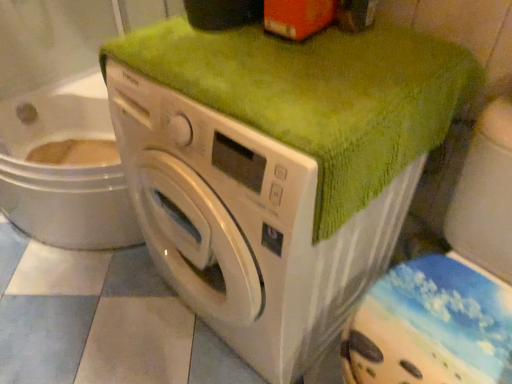
Where is `free point above green textured towel at upper center (from a real-world perspective)`? The height and width of the screenshot is (384, 512). free point above green textured towel at upper center (from a real-world perspective) is located at coordinates (292, 57).